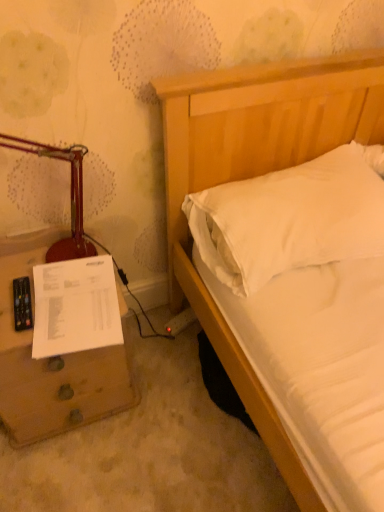
Question: Considering the relative positions of white paper at lower left and matte red table lamp at left in the image provided, is white paper at lower left to the left of matte red table lamp at left from the viewer's perspective?

Choices:
 (A) no
 (B) yes

Answer: (A)

Question: Considering the relative sizes of white paper at lower left and matte red table lamp at left in the image provided, is white paper at lower left wider than matte red table lamp at left?

Choices:
 (A) no
 (B) yes

Answer: (B)

Question: From the image's perspective, is white paper at lower left over matte red table lamp at left?

Choices:
 (A) no
 (B) yes

Answer: (A)

Question: From the image's perspective, would you say white paper at lower left is shown under matte red table lamp at left?

Choices:
 (A) yes
 (B) no

Answer: (A)

Question: Considering the relative sizes of white paper at lower left and matte red table lamp at left in the image provided, is white paper at lower left thinner than matte red table lamp at left?

Choices:
 (A) yes
 (B) no

Answer: (B)

Question: Would you say white paper at lower left contains matte red table lamp at left?

Choices:
 (A) yes
 (B) no

Answer: (B)

Question: From a real-world perspective, is brown wooden nightstand at lower left located beneath matte red table lamp at left?

Choices:
 (A) yes
 (B) no

Answer: (A)

Question: Is matte red table lamp at left at the back of brown wooden nightstand at lower left?

Choices:
 (A) no
 (B) yes

Answer: (A)

Question: Is brown wooden nightstand at lower left in contact with matte red table lamp at left?

Choices:
 (A) yes
 (B) no

Answer: (B)

Question: Considering the relative sizes of brown wooden nightstand at lower left and matte red table lamp at left in the image provided, is brown wooden nightstand at lower left wider than matte red table lamp at left?

Choices:
 (A) no
 (B) yes

Answer: (B)

Question: Is brown wooden nightstand at lower left at the right side of matte red table lamp at left?

Choices:
 (A) yes
 (B) no

Answer: (A)

Question: Considering the relative sizes of brown wooden nightstand at lower left and matte red table lamp at left in the image provided, is brown wooden nightstand at lower left taller than matte red table lamp at left?

Choices:
 (A) no
 (B) yes

Answer: (B)

Question: Does white soft pillow at upper right have a greater height compared to white paper at lower left?

Choices:
 (A) yes
 (B) no

Answer: (A)